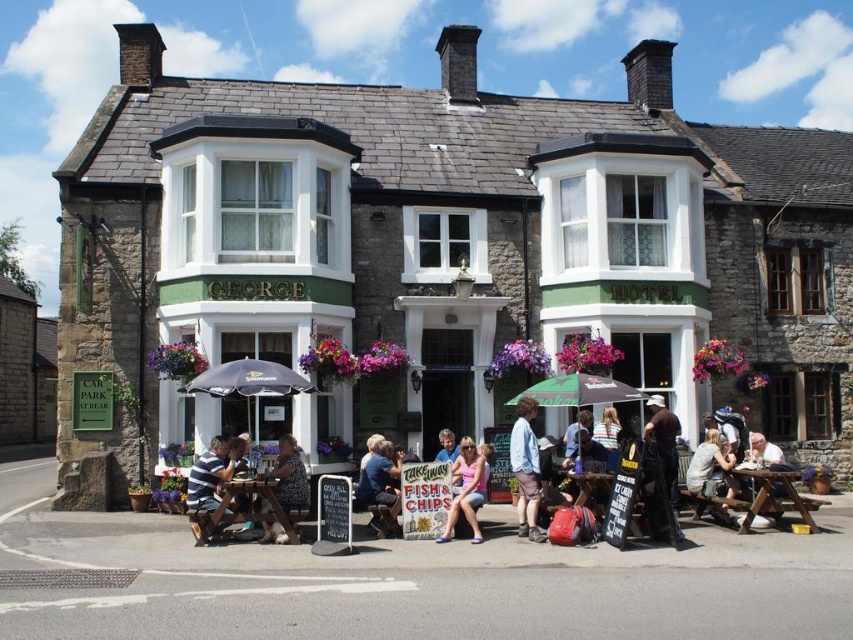
Who is more distant from viewer, (206, 388) or (213, 442)?

Positioned behind is point (206, 388).

Which is more to the right, black fabric umbrella at center or striped cotton shirt at lower left?

From the viewer's perspective, black fabric umbrella at center appears more on the right side.

Locate an element on the screen. black fabric umbrella at center is located at coordinates (248, 380).

Who is more forward, (299,461) or (660,422)?

Point (299,461)

Is patterned fabric shirt at center bigger than brown leather jacket at center?

No.

Is point (273, 525) less distant than point (647, 436)?

Yes, point (273, 525) is closer to viewer.

Where is `patterned fabric shirt at center`? patterned fabric shirt at center is located at coordinates (289, 476).

Identify the location of denim jacket at center. (526, 468).

Who is lower down, denim jacket at center or striped cotton shirt at lower left?

Positioned lower is denim jacket at center.

Locate an element on the screen. denim jacket at center is located at coordinates (526, 468).

Identify the location of denim jacket at center. Image resolution: width=853 pixels, height=640 pixels. (526, 468).